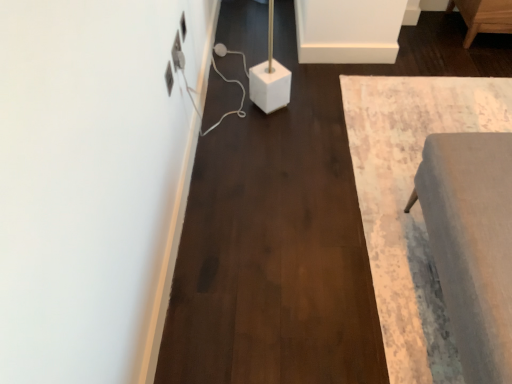
What do you see at coordinates (177, 54) in the screenshot? The width and height of the screenshot is (512, 384). I see `white plastic electric outlet at upper left` at bounding box center [177, 54].

Identify the location of white plastic electric outlet at upper left. The width and height of the screenshot is (512, 384). (177, 54).

Where is `white plastic electric outlet at upper left`? This screenshot has width=512, height=384. white plastic electric outlet at upper left is located at coordinates (177, 54).